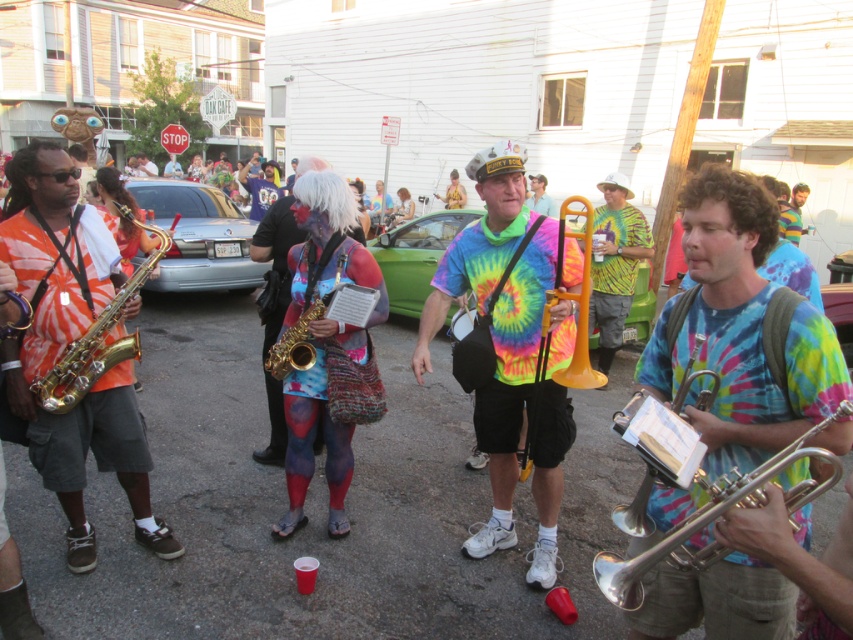
Can you confirm if shiny silver trumpet at center is positioned below body-painted tie-dye saxophone player at center?

Correct, shiny silver trumpet at center is located below body-painted tie-dye saxophone player at center.

Is point (700, 428) less distant than point (293, 417)?

Yes.

Where is `shiny silver trumpet at center`? This screenshot has height=640, width=853. shiny silver trumpet at center is located at coordinates (740, 330).

Measure the distance from shiny silver trumpet at center to silver metallic trumpet at right.

shiny silver trumpet at center and silver metallic trumpet at right are 6.07 inches apart from each other.

Is point (705, 444) in front of point (781, 456)?

No, (705, 444) is behind (781, 456).

Locate an element on the screen. shiny silver trumpet at center is located at coordinates click(x=740, y=330).

Can you confirm if gold brass trumpet at left is shorter than body paint saxophone at center?

Indeed, gold brass trumpet at left has a lesser height compared to body paint saxophone at center.

What do you see at coordinates (96, 340) in the screenshot? I see `gold brass trumpet at left` at bounding box center [96, 340].

The height and width of the screenshot is (640, 853). Identify the location of gold brass trumpet at left. (96, 340).